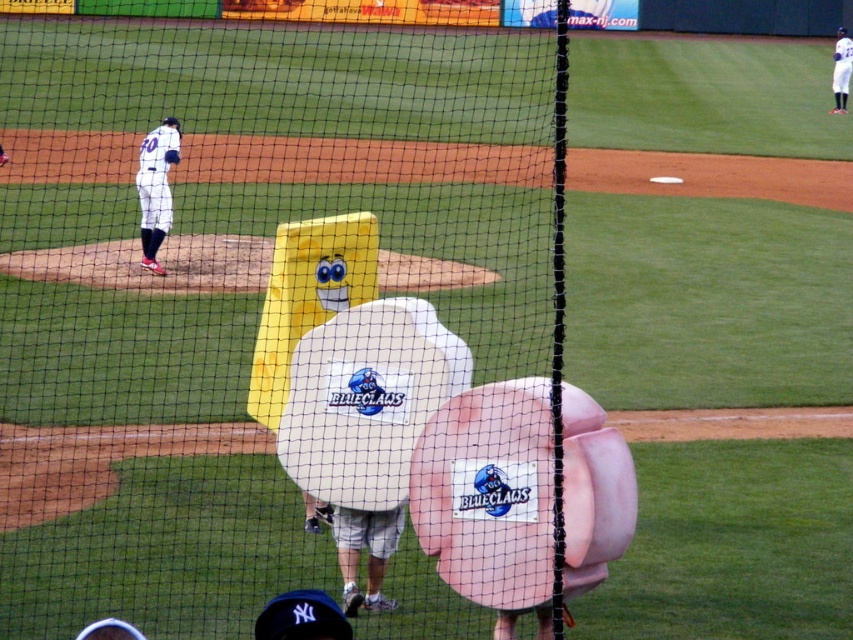
Is white jersey at center taller than white uniform at upper left?

In fact, white jersey at center may be shorter than white uniform at upper left.

Is white jersey at center behind white uniform at upper left?

No, white jersey at center is in front of white uniform at upper left.

You are a GUI agent. You are given a task and a screenshot of the screen. Output one action in this format:
    pyautogui.click(x=<x>, y=<y>)
    Task: Click on the white jersey at center
    The height and width of the screenshot is (640, 853).
    Given the screenshot: What is the action you would take?
    click(x=155, y=189)

Can you confirm if black mesh net at center is positioned below white jersey at center?

No, black mesh net at center is not below white jersey at center.

Who is more forward, [78,368] or [175,128]?

Point [78,368]

At what (x,y) coordinates should I click in order to perform the action: click on black mesh net at center. Please return your answer as a coordinate pair (x, y). Looking at the image, I should click on (276, 323).

Locate an element on the screen. black mesh net at center is located at coordinates (276, 323).

Consider the image. Can you confirm if white jersey at center is positioned above matte white glove at upper center?

No.

The height and width of the screenshot is (640, 853). In order to click on white jersey at center in this screenshot , I will do `click(155, 189)`.